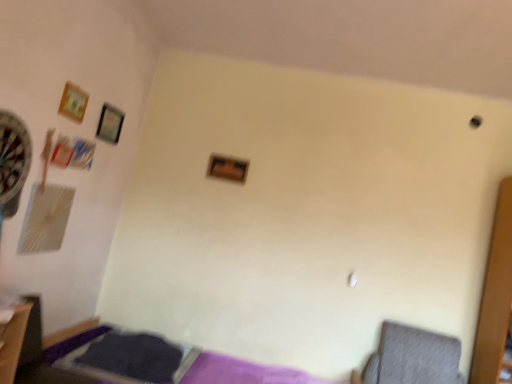
At what (x,y) coordinates should I click in order to perform the action: click on blank space above metallic silver dartboard at left (from a real-world perspective). Please return your answer as a coordinate pair (x, y). Image resolution: width=512 pixels, height=384 pixels. Looking at the image, I should click on (20, 110).